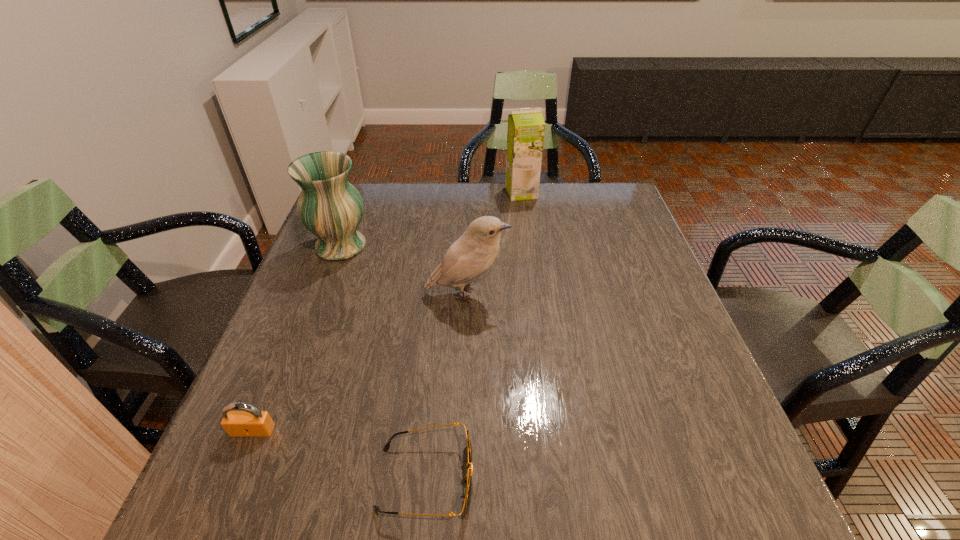
This screenshot has width=960, height=540. What are the coordinates of `vacant space at the near right corner` in the screenshot? It's located at (748, 497).

You are a GUI agent. You are given a task and a screenshot of the screen. Output one action in this format:
    pyautogui.click(x=<x>, y=<y>)
    Task: Click on the free space between the shortest object and the vase
    
    Given the screenshot: What is the action you would take?
    pyautogui.click(x=383, y=362)

Identify the location of free area in between the shortest object and the fourth nearest object. pyautogui.click(x=383, y=362).

Where is `free spot between the shortest object and the bird`? The width and height of the screenshot is (960, 540). free spot between the shortest object and the bird is located at coordinates (446, 387).

The height and width of the screenshot is (540, 960). Find the location of `vacant area that lies between the fourth nearest object and the third nearest object`. vacant area that lies between the fourth nearest object and the third nearest object is located at coordinates (404, 270).

At what (x,y) coordinates should I click in order to perform the action: click on vacant area that lies between the padlock and the soya milk. Please return your answer as a coordinate pair (x, y). The height and width of the screenshot is (540, 960). Looking at the image, I should click on (387, 312).

Locate an element on the screen. free spot between the rightmost object and the second farthest object is located at coordinates (431, 219).

You are a GUI agent. You are given a task and a screenshot of the screen. Output one action in this format:
    pyautogui.click(x=<x>, y=<y>)
    Task: Click on the empty location between the shortest object and the fourth nearest object
    This screenshot has width=960, height=540.
    Given the screenshot: What is the action you would take?
    pyautogui.click(x=383, y=362)

Find the location of a particular element. This screenshot has height=540, width=960. free space between the shortest object and the second shortest object is located at coordinates (340, 455).

Identify the location of vacant point located between the farthest object and the sunglasses. (473, 336).